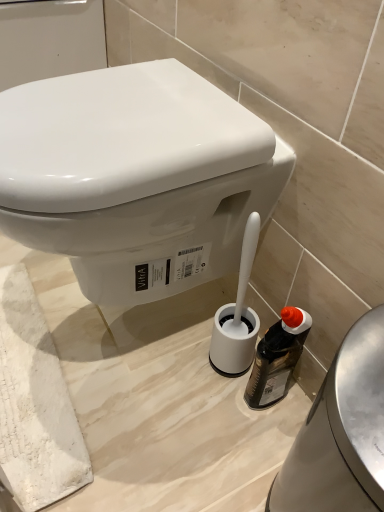
You are a GUI agent. You are given a task and a screenshot of the screen. Output one action in this format:
    pyautogui.click(x=<x>, y=<y>)
    Task: Click on the vacant region above white glossy toilet at center (from a real-world perspective)
    
    Given the screenshot: What is the action you would take?
    pyautogui.click(x=127, y=99)